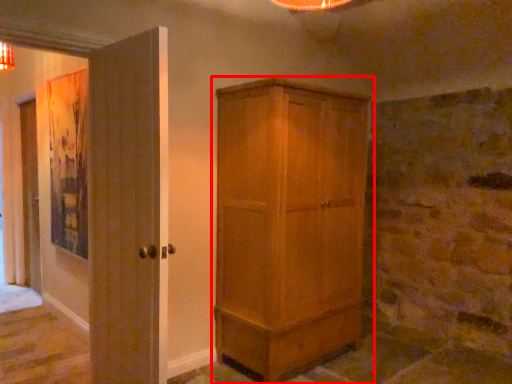
Question: In this image, where is cupboard (annotated by the red box) located relative to door?

Choices:
 (A) right
 (B) left

Answer: (A)